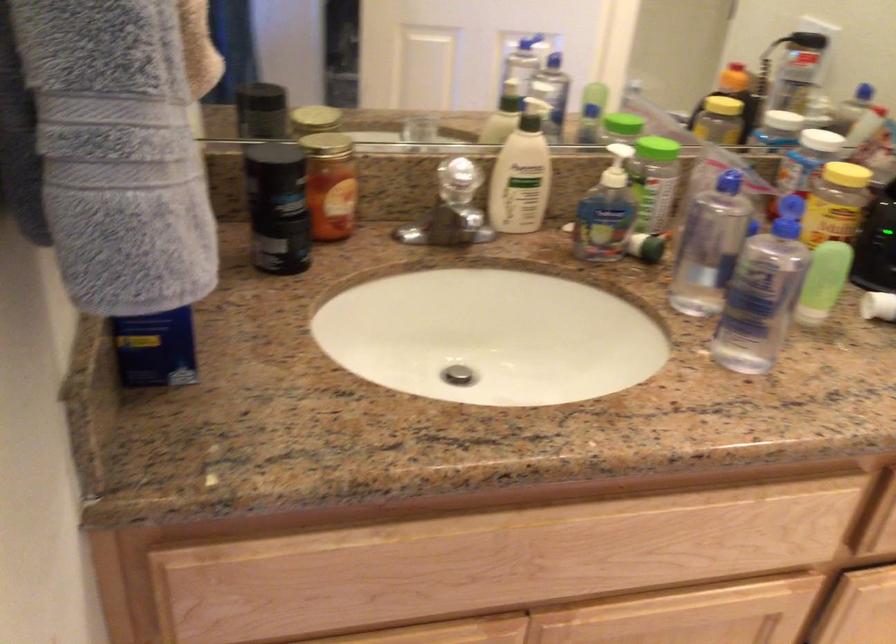
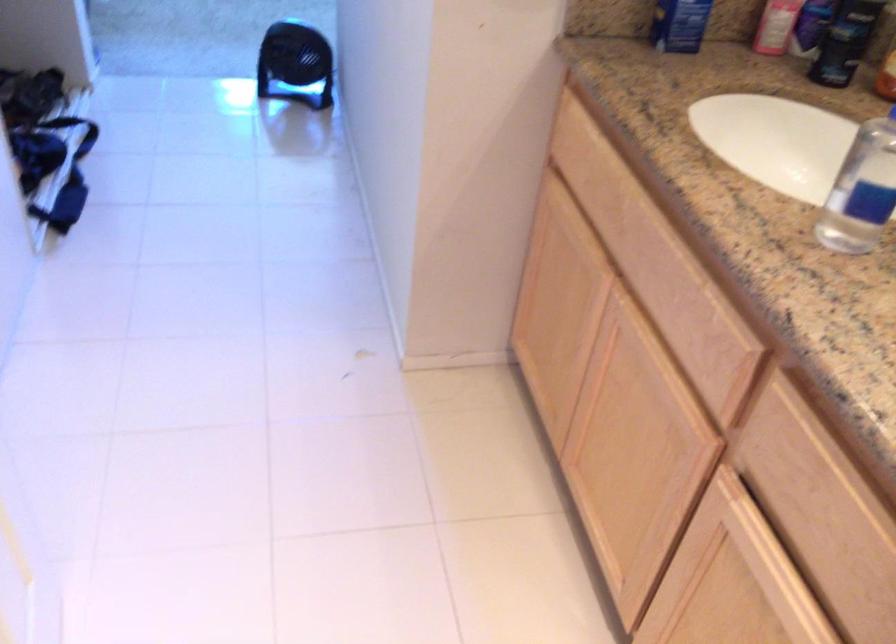
Locate, in the second image, the point that corresponds to (x=200, y=321) in the first image.

(679, 24)